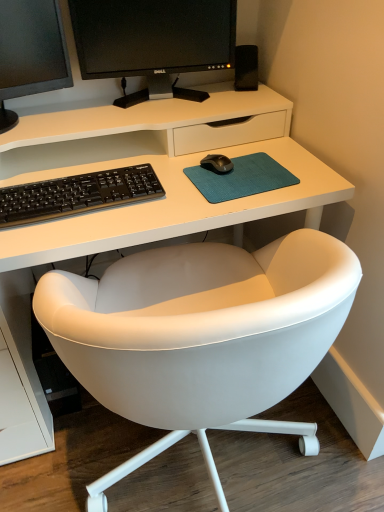
Find the location of a particular element. vacant area on top of black matte keyboard at center (from a real-world perspective) is located at coordinates (69, 184).